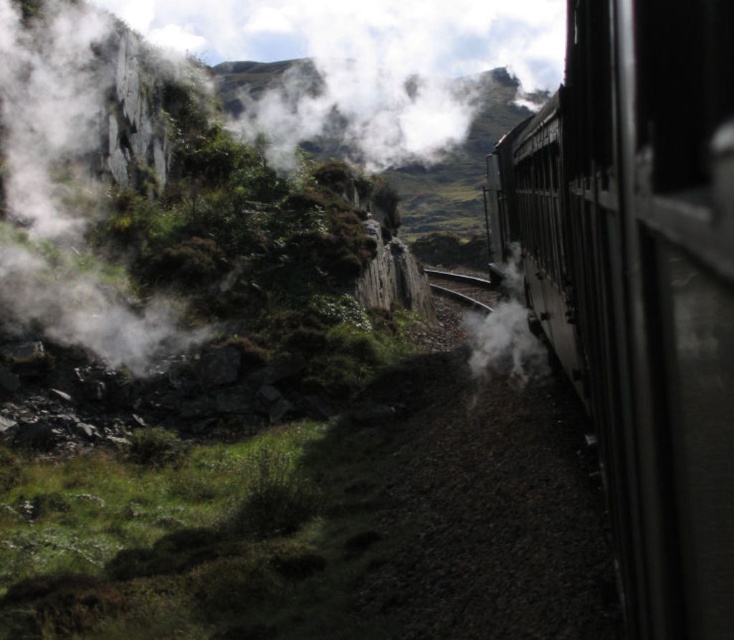
You are standing inside the train and looking out the window. There is a point marked at coordinate (639, 284). Based on the scene description, where is this point located?

The point is located on the polished metal train at the right side of the window view.